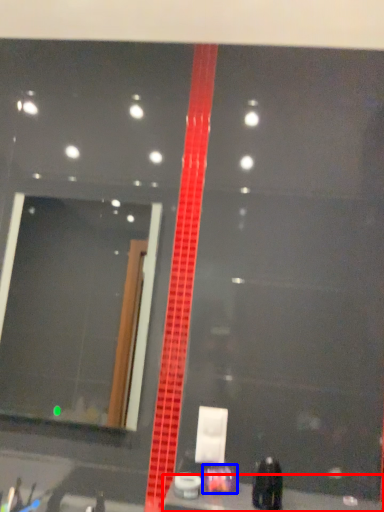
Question: Which point is further to the camera, counter top (highlighted by a red box) or toiletry (highlighted by a blue box)?

Choices:
 (A) counter top
 (B) toiletry

Answer: (B)